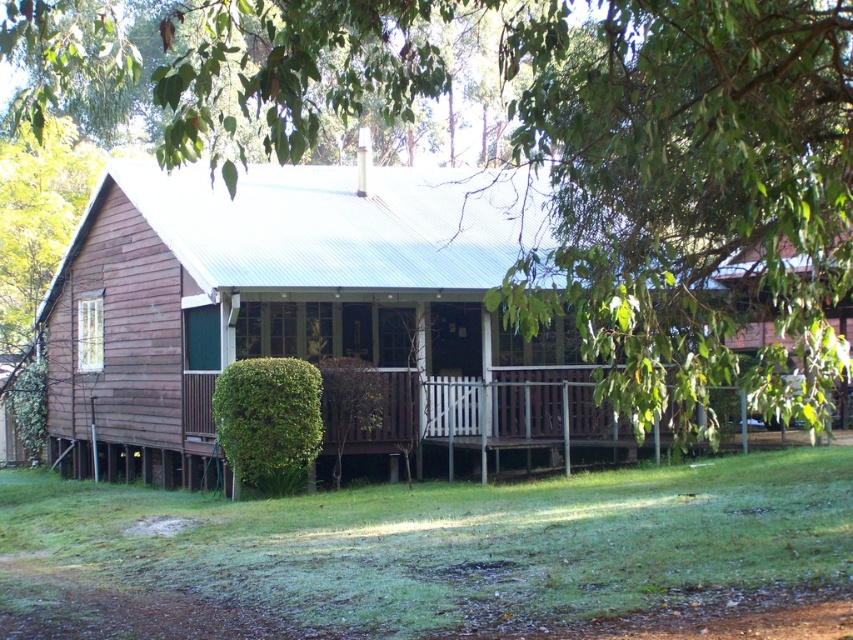
You are standing at the entrance of the wooden house and want to walk towards the green grass at lower center. Which direction should you move relative to the green leafy tree at center?

You should move to the right of the green leafy tree at center to reach the green grass at lower center because the green grass at lower center is to the right of the green leafy tree at center.

You are standing at the entrance of the wooden house and want to walk towards the point labeled point (625, 218). However, there is an obstacle at point (148, 531). Will you encounter the obstacle before reaching your destination?

Yes, you will encounter the obstacle at point (148, 531) before reaching point (625, 218) because point (625, 218) is behind point (148, 531).

You are standing on the porch of the wooden house and looking towards the green leafy tree at center and the green grass at lower center. Which object is taller?

The green leafy tree at center is much taller than the green grass at lower center.